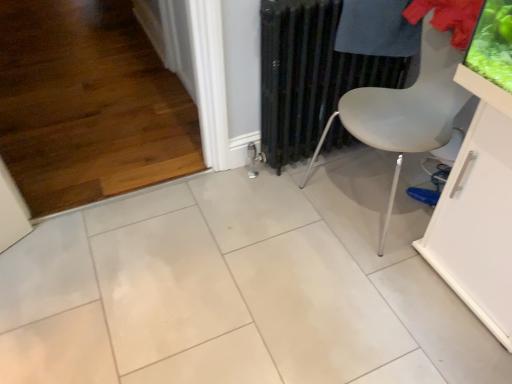
Describe the element at coordinates (478, 212) in the screenshot. I see `white glossy table at lower right` at that location.

In order to click on dark blue fabric at upper right in this screenshot , I will do `click(377, 29)`.

Where is `white matte chair at center-right`? Image resolution: width=512 pixels, height=384 pixels. white matte chair at center-right is located at coordinates (406, 109).

From the image's perspective, does black metal radiator at center appear higher than blue fabric shoe at lower right?

Yes, from the image's perspective, black metal radiator at center is over blue fabric shoe at lower right.

Is black metal radiator at center thinner than blue fabric shoe at lower right?

In fact, black metal radiator at center might be wider than blue fabric shoe at lower right.

Is black metal radiator at center facing towards blue fabric shoe at lower right?

Yes, black metal radiator at center is aimed at blue fabric shoe at lower right.

Is white matte chair at center-right taller or shorter than black metal radiator at center?

Clearly, white matte chair at center-right is taller compared to black metal radiator at center.

Is white matte chair at center-right positioned in front of black metal radiator at center?

Yes, white matte chair at center-right is closer to the viewer.

How many degrees apart are the facing directions of white matte chair at center-right and black metal radiator at center?

white matte chair at center-right and black metal radiator at center are facing 82.2 degrees away from each other.

Considering the sizes of objects white matte chair at center-right and blue fabric shoe at lower right in the image provided, who is taller, white matte chair at center-right or blue fabric shoe at lower right?

With more height is white matte chair at center-right.

Relative to blue fabric shoe at lower right, is white matte chair at center-right in front or behind?

Clearly, white matte chair at center-right is in front of blue fabric shoe at lower right.

Locate an element on the screen. footwear behind the white glossy table at lower right is located at coordinates (424, 195).

Would you say blue fabric shoe at lower right is part of white glossy table at lower right's contents?

No, white glossy table at lower right does not contain blue fabric shoe at lower right.

Considering the points (510, 267) and (440, 194), which point is in front, point (510, 267) or point (440, 194)?

Point (510, 267)

From a real-world perspective, is white glossy table at lower right physically below blue fabric shoe at lower right?

No.

Considering the points (430, 205) and (471, 255), which point is in front, point (430, 205) or point (471, 255)?

The point (471, 255) is in front.

Based on the photo, can you tell me how much blue fabric shoe at lower right and white glossy table at lower right differ in facing direction?

The angle between the facing direction of blue fabric shoe at lower right and the facing direction of white glossy table at lower right is 31.1 degrees.

From a real-world perspective, is blue fabric shoe at lower right below white glossy table at lower right?

Yes, from a real-world perspective, blue fabric shoe at lower right is beneath white glossy table at lower right.

Locate an element on the screen. The image size is (512, 384). chair behind the white glossy table at lower right is located at coordinates (406, 109).

From the image's perspective, is white matte chair at center-right above or below white glossy table at lower right?

Based on their image positions, white matte chair at center-right is located above white glossy table at lower right.

Would you say white matte chair at center-right is a long distance from white glossy table at lower right?

They are positioned close to each other.

From the picture: Can you confirm if white matte chair at center-right is smaller than white glossy table at lower right?

No, white matte chair at center-right is not smaller than white glossy table at lower right.

Considering the relative sizes of blue fabric shoe at lower right and black metal radiator at center in the image provided, is blue fabric shoe at lower right thinner than black metal radiator at center?

Indeed, blue fabric shoe at lower right has a lesser width compared to black metal radiator at center.

Would you say blue fabric shoe at lower right is a long distance from black metal radiator at center?

blue fabric shoe at lower right is near black metal radiator at center, not far away.

Identify the location of footwear behind the black metal radiator at center. The width and height of the screenshot is (512, 384). (x=424, y=195).

Choose the correct answer: Is blue fabric shoe at lower right inside black metal radiator at center or outside it?

blue fabric shoe at lower right is not enclosed by black metal radiator at center.

I want to click on radiator above the blue fabric shoe at lower right (from a real-world perspective), so (x=309, y=75).

In the image, there is a black metal radiator at center. Identify the location of chair below it (from the image's perspective). This screenshot has height=384, width=512. tap(406, 109).

Based on their spatial positions, is dark blue fabric at upper right or white matte chair at center-right closer to black metal radiator at center?

dark blue fabric at upper right is closer to black metal radiator at center.

When comparing their distances from blue fabric shoe at lower right, does white matte chair at center-right or white glossy table at lower right seem further?

The object further to blue fabric shoe at lower right is white matte chair at center-right.

Looking at the image, which one is located further to white matte chair at center-right, blue fabric shoe at lower right or dark blue fabric at upper right?

blue fabric shoe at lower right is positioned further to the anchor white matte chair at center-right.

Based on their spatial positions, is white glossy table at lower right or black metal radiator at center further from blue fabric shoe at lower right?

black metal radiator at center lies further to blue fabric shoe at lower right than the other object.

Estimate the real-world distances between objects in this image. Which object is closer to black metal radiator at center, white glossy table at lower right or dark blue fabric at upper right?

dark blue fabric at upper right is closer to black metal radiator at center.

Based on their spatial positions, is white matte chair at center-right or dark blue fabric at upper right closer to blue fabric shoe at lower right?

Among the two, white matte chair at center-right is located nearer to blue fabric shoe at lower right.

Looking at the image, which one is located further to dark blue fabric at upper right, blue fabric shoe at lower right or white glossy table at lower right?

blue fabric shoe at lower right is further to dark blue fabric at upper right.

Looking at this image, when comparing their distances from white glossy table at lower right, does blue fabric shoe at lower right or white matte chair at center-right seem further?

blue fabric shoe at lower right is positioned further to the anchor white glossy table at lower right.

Where is `radiator between white matte chair at center-right and blue fabric shoe at lower right along the z-axis`? Image resolution: width=512 pixels, height=384 pixels. radiator between white matte chair at center-right and blue fabric shoe at lower right along the z-axis is located at coordinates (309, 75).

Identify the location of chair between black metal radiator at center and white glossy table at lower right from left to right. This screenshot has width=512, height=384. (406, 109).

I want to click on radiator between white glossy table at lower right and blue fabric shoe at lower right along the z-axis, so click(309, 75).

The image size is (512, 384). I want to click on radiator between white matte chair at center-right and dark blue fabric at upper right from front to back, so click(x=309, y=75).